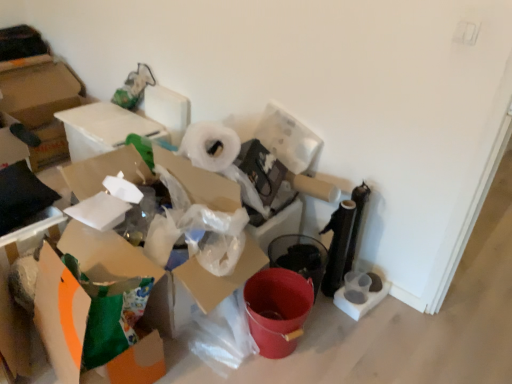
Locate an element on the screen. This screenshot has height=384, width=512. vacant space to the right of transparent plastic toilet paper at lower right is located at coordinates (400, 312).